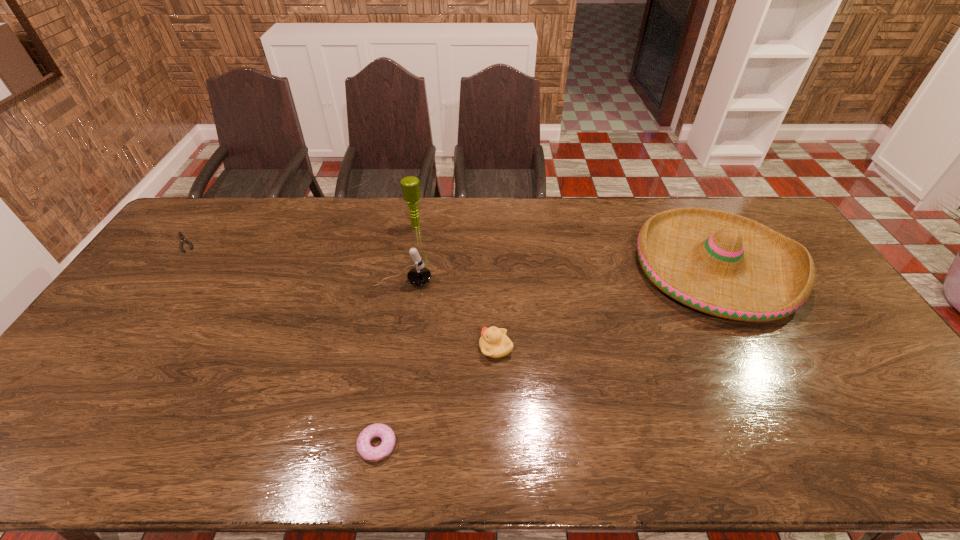
Locate an element on the screen. Image resolution: width=960 pixels, height=540 pixels. free space located 0.090m on the back of the tallest object is located at coordinates (420, 206).

Where is `free space located on the front of the rightmost object`? free space located on the front of the rightmost object is located at coordinates (759, 349).

Locate an element on the screen. The width and height of the screenshot is (960, 540). free space located 0.260m on the right of the shorter microphone is located at coordinates (515, 281).

This screenshot has width=960, height=540. Find the location of `vacant space positioned on the beak of the fifth object from left to right`. vacant space positioned on the beak of the fifth object from left to right is located at coordinates (354, 348).

Identify the location of free location located 0.060m on the beak of the fifth object from left to right. This screenshot has width=960, height=540. (457, 348).

Locate an element on the screen. free space located on the beak of the fifth object from left to right is located at coordinates (344, 348).

Where is `vacant space positioned on the left of the second shortest object`? The width and height of the screenshot is (960, 540). vacant space positioned on the left of the second shortest object is located at coordinates (279, 445).

Where is `vacant area situated 0.140m on the back of the leftmost object`? The height and width of the screenshot is (540, 960). vacant area situated 0.140m on the back of the leftmost object is located at coordinates (209, 208).

At what (x,y) coordinates should I click in order to perform the action: click on microphone located in the far edge section of the desktop. Please return your answer as a coordinate pair (x, y). Image resolution: width=960 pixels, height=540 pixels. Looking at the image, I should click on [410, 185].

Where is `sombrero that is at the far edge`? sombrero that is at the far edge is located at coordinates pyautogui.click(x=719, y=263).